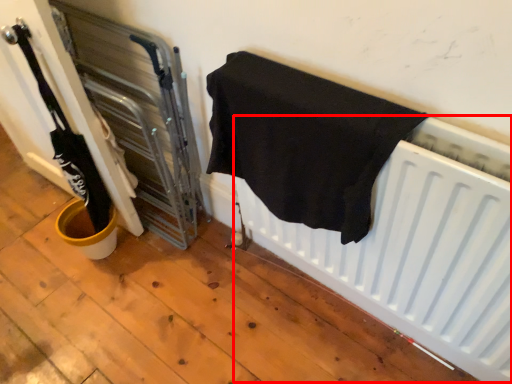
Question: From the image, what is the correct spatial relationship of radiator (annotated by the red box) in relation to towel?

Choices:
 (A) left
 (B) right

Answer: (B)